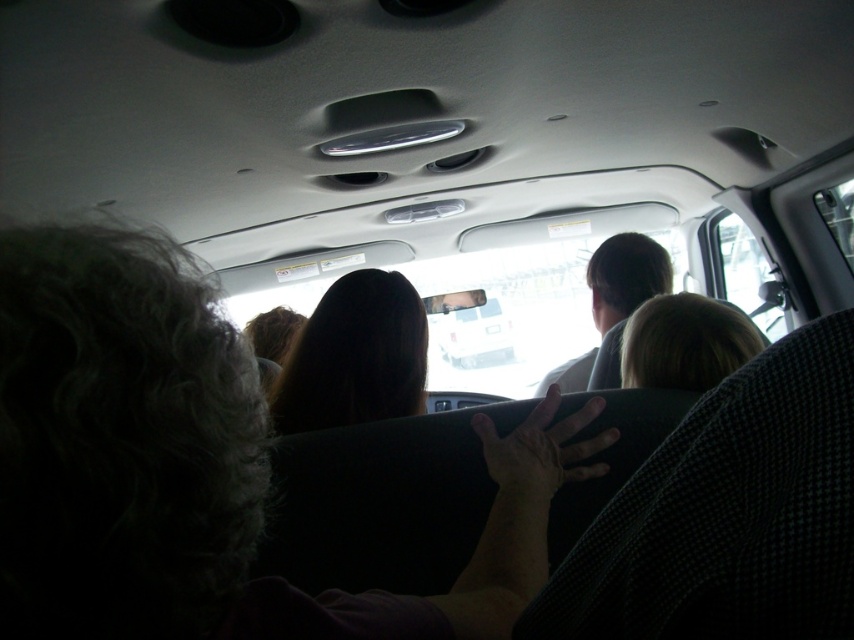
Question: Among these objects, which one is farthest from the camera?

Choices:
 (A) dark brown hair at center
 (B) blonde hair at center

Answer: (A)

Question: Considering the real-world distances, which object is closest to the light brown hair at center?

Choices:
 (A) dark brown hair at center
 (B) blonde hair at center
 (C) white glossy car at center

Answer: (B)

Question: In this image, where is dark brown hair at center located relative to light brown hair at center?

Choices:
 (A) right
 (B) left

Answer: (B)

Question: Can you confirm if light brown hair at center is bigger than white glossy car at center?

Choices:
 (A) no
 (B) yes

Answer: (B)

Question: Can you confirm if dark brown hair at center is smaller than light brown hair at center?

Choices:
 (A) no
 (B) yes

Answer: (B)

Question: Which point is farther to the camera?

Choices:
 (A) dark brown hair at center
 (B) white glossy car at center
 (C) light brown hair at center

Answer: (B)